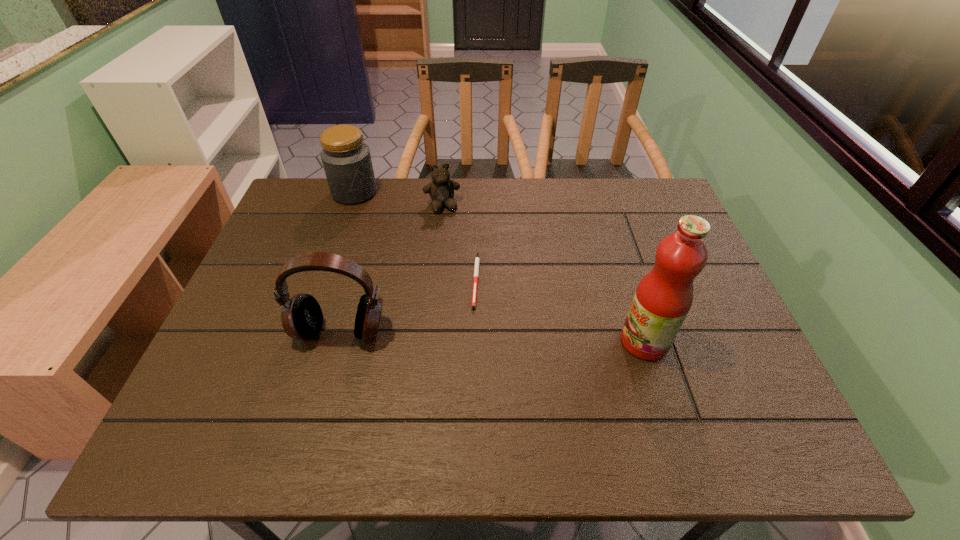
Image resolution: width=960 pixels, height=540 pixels. I want to click on vacant region located on the surface of the jar near the warning symbol, so pos(383,234).

In order to click on teddy bear situated at the far edge in this screenshot , I will do `click(441, 190)`.

I want to click on jar that is at the far edge, so click(346, 159).

At what (x,y) coordinates should I click in order to perform the action: click on headset present at the left edge. Please return your answer as a coordinate pair (x, y). Image resolution: width=960 pixels, height=540 pixels. Looking at the image, I should click on (301, 315).

At what (x,y) coordinates should I click in order to perform the action: click on jar that is at the left edge. Please return your answer as a coordinate pair (x, y). The width and height of the screenshot is (960, 540). Looking at the image, I should click on (346, 159).

At what (x,y) coordinates should I click in order to perform the action: click on object that is at the far left corner. Please return your answer as a coordinate pair (x, y). This screenshot has height=540, width=960. Looking at the image, I should click on (346, 159).

Where is `vacant space at the far edge`? vacant space at the far edge is located at coordinates (405, 185).

In the image, there is a desktop. At what (x,y) coordinates should I click in order to perform the action: click on vacant space at the near edge. Please return your answer as a coordinate pair (x, y). The height and width of the screenshot is (540, 960). Looking at the image, I should click on (379, 388).

Locate an element on the screen. This screenshot has height=540, width=960. free space at the left edge of the desktop is located at coordinates (272, 288).

This screenshot has width=960, height=540. In the image, there is a desktop. Identify the location of vacant space at the right edge. (684, 343).